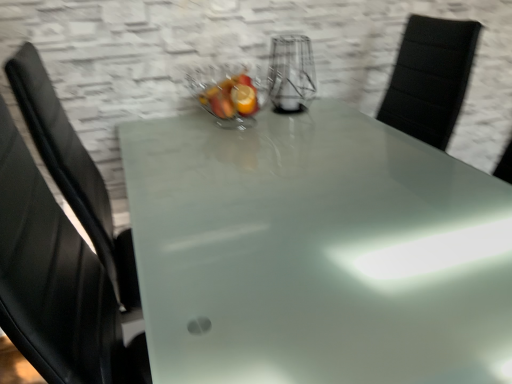
Question: From a real-world perspective, is clear glass bowl at center located higher than clear glass vase at center?

Choices:
 (A) no
 (B) yes

Answer: (A)

Question: Is clear glass bowl at center next to clear glass vase at center and touching it?

Choices:
 (A) yes
 (B) no

Answer: (B)

Question: Does clear glass bowl at center have a larger size compared to clear glass vase at center?

Choices:
 (A) yes
 (B) no

Answer: (A)

Question: Would you say clear glass vase at center is part of clear glass bowl at center's contents?

Choices:
 (A) no
 (B) yes

Answer: (A)

Question: Is clear glass bowl at center positioned far away from clear glass vase at center?

Choices:
 (A) no
 (B) yes

Answer: (A)

Question: From the image's perspective, is clear glass bowl at center above or below clear glass vase at center?

Choices:
 (A) below
 (B) above

Answer: (A)

Question: From a real-world perspective, is clear glass bowl at center above or below clear glass vase at center?

Choices:
 (A) above
 (B) below

Answer: (B)

Question: In terms of size, does clear glass bowl at center appear bigger or smaller than clear glass vase at center?

Choices:
 (A) small
 (B) big

Answer: (B)

Question: Considering the positions of clear glass bowl at center and clear glass vase at center in the image, is clear glass bowl at center taller or shorter than clear glass vase at center?

Choices:
 (A) short
 (B) tall

Answer: (A)

Question: Would you say clear glass vase at center is to the left or to the right of clear glass bowl at center in the picture?

Choices:
 (A) right
 (B) left

Answer: (A)

Question: In the image, is clear glass vase at center positioned in front of or behind clear glass bowl at center?

Choices:
 (A) front
 (B) behind

Answer: (B)

Question: In terms of size, does clear glass vase at center appear bigger or smaller than clear glass bowl at center?

Choices:
 (A) big
 (B) small

Answer: (B)

Question: Is clear glass vase at center wider or thinner than clear glass bowl at center?

Choices:
 (A) thin
 (B) wide

Answer: (A)

Question: Considering the positions of point (251, 124) and point (437, 266), is point (251, 124) closer or farther from the camera than point (437, 266)?

Choices:
 (A) farther
 (B) closer

Answer: (A)

Question: Is clear glass bowl at center inside the boundaries of frosted glass table at center, or outside?

Choices:
 (A) inside
 (B) outside

Answer: (B)